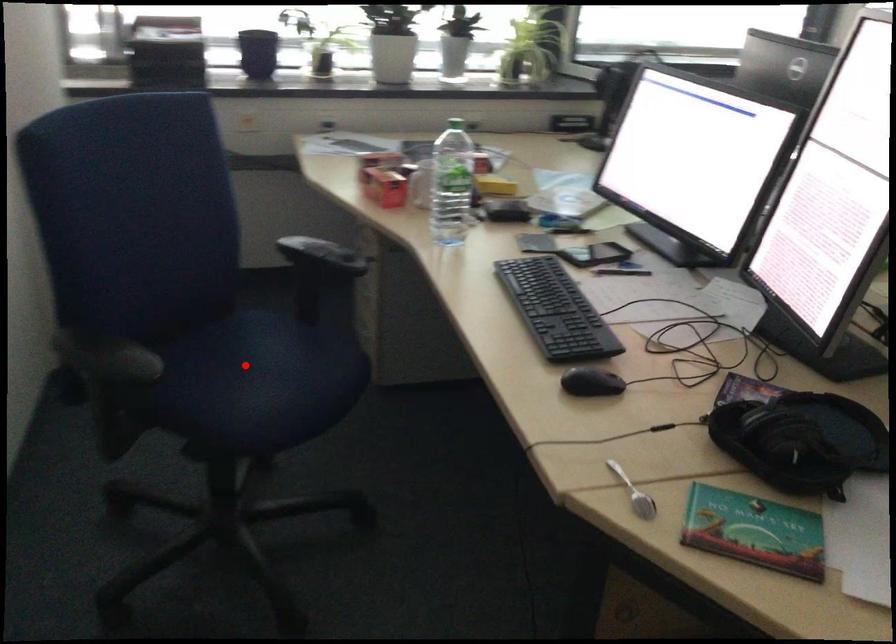
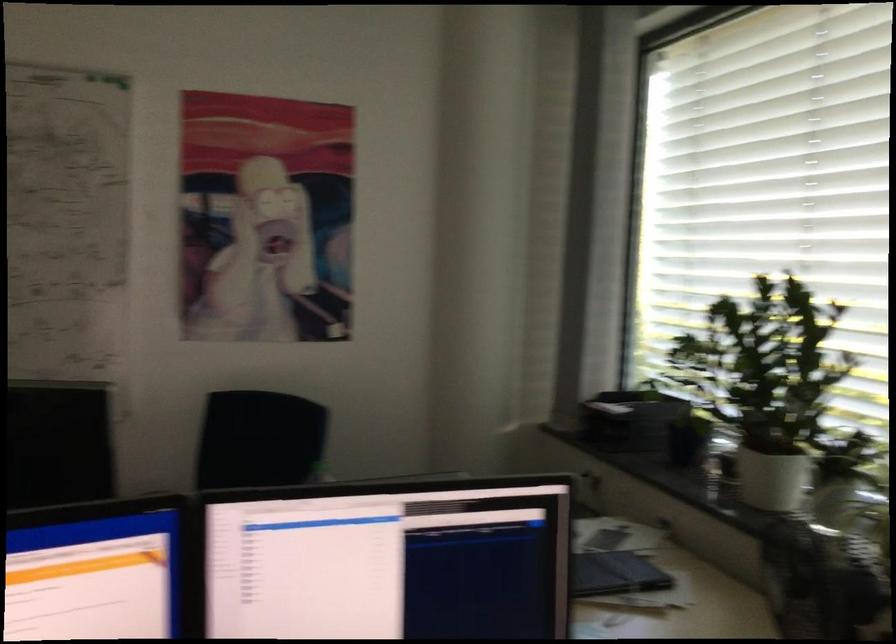
Question: I am providing you with two images of the same scene from different viewpoints. A red point is marked on the first image. At the location where the point appears in image 1, is it still visible in image 2?

Choices:
 (A) Yes
 (B) No

Answer: (B)